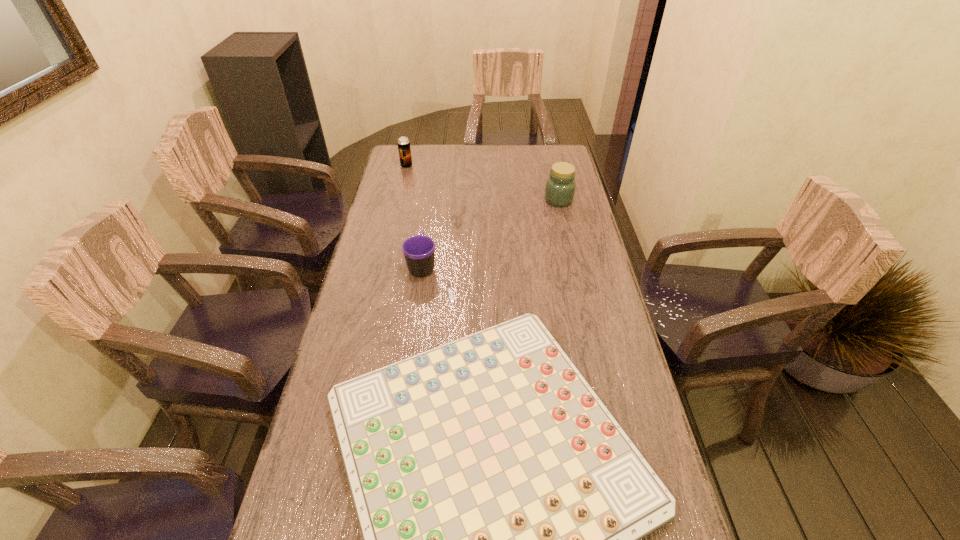
The image size is (960, 540). Identify the location of free spot between the mug and the jar. (491, 233).

Find the location of a particular element. free space between the beer can and the third farthest object is located at coordinates (415, 216).

This screenshot has width=960, height=540. I want to click on free space that is in between the third farthest object and the farthest object, so click(x=415, y=216).

The height and width of the screenshot is (540, 960). Identify the location of free spot between the beer can and the third tallest object. (415, 216).

You are a GUI agent. You are given a task and a screenshot of the screen. Output one action in this format:
    pyautogui.click(x=<x>, y=<y>)
    Task: Click on the second closest object to the third nearest object
    
    Given the screenshot: What is the action you would take?
    pyautogui.click(x=501, y=505)

Select which object is the second closest to the second nearest object. Please provide its 2D coordinates. Your answer should be formatted as a tuple, i.e. [(x, y)], where the tuple contains the x and y coordinates of a point satisfying the conditions above.

[(560, 187)]

Find the location of a particular element. This screenshot has height=540, width=960. blank area in the image that satisfies the following two spatial constraints: 1. with the handle on the side of the third nearest object; 2. on the left side of the mug is located at coordinates (431, 200).